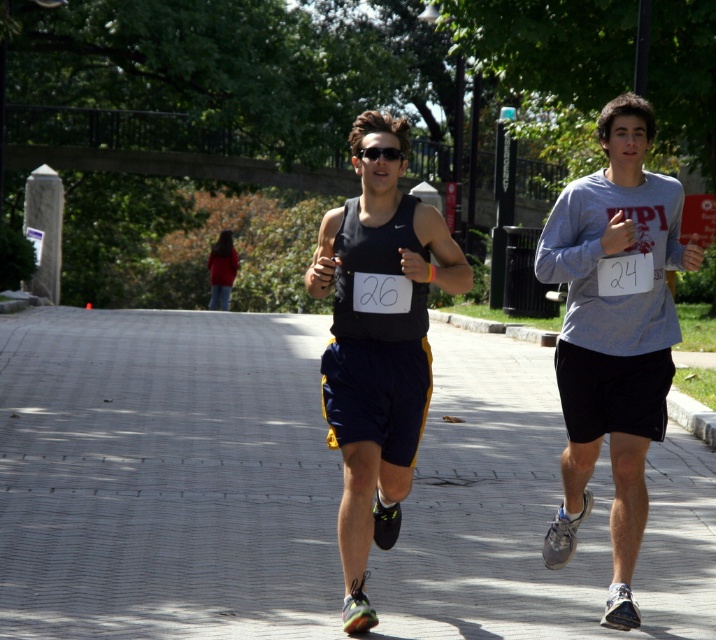
Question: Which object appears farthest from the camera in this image?

Choices:
 (A) matte black tank top at center
 (B) black plastic sunglasses at center
 (C) gray brick pavement at center
 (D) red fleece jacket at center

Answer: (D)

Question: Estimate the real-world distances between objects in this image. Which object is farther from the gray cotton shirt at right?

Choices:
 (A) gray brick pavement at center
 (B) matte black tank top at center

Answer: (A)

Question: Is gray brick pavement at center to the left of gray cotton shirt at right from the viewer's perspective?

Choices:
 (A) no
 (B) yes

Answer: (B)

Question: Can you confirm if gray cotton shirt at right is smaller than red fleece jacket at center?

Choices:
 (A) yes
 (B) no

Answer: (A)

Question: Among these points, which one is nearest to the camera?

Choices:
 (A) (359, 561)
 (B) (195, 579)
 (C) (653, 381)
 (D) (223, 280)

Answer: (A)

Question: Does gray brick pavement at center appear over red fleece jacket at center?

Choices:
 (A) yes
 (B) no

Answer: (B)